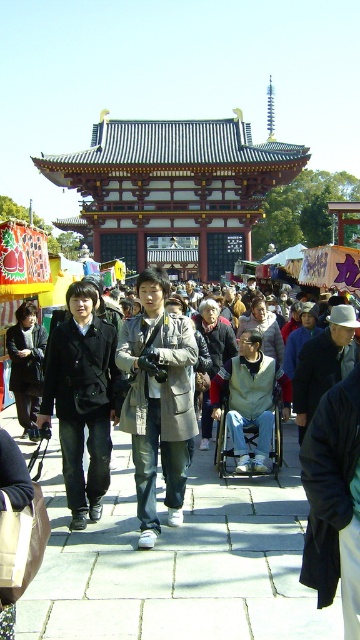
Question: Which object is positioned farthest from the black leather jacket at center?

Choices:
 (A) beige fabric coat at center
 (B) gray plastic wheelchair at center

Answer: (B)

Question: Does shiny dark brown wooden gate at center have a greater width compared to white felt hat at center?

Choices:
 (A) no
 (B) yes

Answer: (B)

Question: Which object appears farthest from the camera in this image?

Choices:
 (A) black fabric coat at center
 (B) gray plastic wheelchair at center
 (C) shiny dark brown wooden gate at center

Answer: (C)

Question: Is white felt hat at center wider than gray plastic wheelchair at center?

Choices:
 (A) no
 (B) yes

Answer: (B)

Question: Considering the relative positions of black fabric coat at center and gray plastic wheelchair at center in the image provided, where is black fabric coat at center located with respect to gray plastic wheelchair at center?

Choices:
 (A) below
 (B) above

Answer: (B)

Question: Which is nearer to the black leather jacket at center?

Choices:
 (A) white felt hat at center
 (B) beige fabric coat at center
 (C) gray plastic wheelchair at center

Answer: (B)